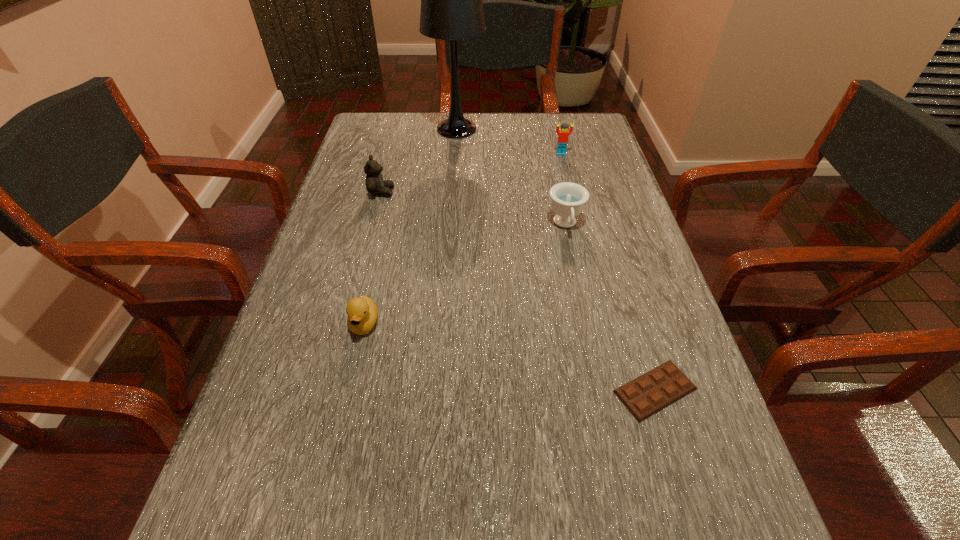
The image size is (960, 540). Identify the location of free spot located 0.350m on the face of the fifth nearest object. pyautogui.click(x=581, y=235).

Image resolution: width=960 pixels, height=540 pixels. I want to click on vacant region located on the side of the third nearest object with the handle, so click(580, 293).

The height and width of the screenshot is (540, 960). Find the location of `vacant area located facing forward on the duckling`. vacant area located facing forward on the duckling is located at coordinates (342, 424).

You are a GUI agent. You are given a task and a screenshot of the screen. Output one action in this format:
    pyautogui.click(x=<x>, y=<y>)
    Task: Click on the free location located on the back of the chocolate bar
    
    Given the screenshot: What is the action you would take?
    pyautogui.click(x=639, y=338)

Where is `table lamp located in the far edge section of the desktop`? The height and width of the screenshot is (540, 960). table lamp located in the far edge section of the desktop is located at coordinates (451, 0).

Where is `Lego that is at the far edge`? The image size is (960, 540). Lego that is at the far edge is located at coordinates (563, 134).

Identify the location of teddy bear situated at the left edge. (375, 184).

What are the coordinates of `duckling that is at the left edge` in the screenshot? It's located at (362, 311).

Find the location of a particular element. Lego located at the right edge is located at coordinates pyautogui.click(x=563, y=134).

Find the location of a particular element. This screenshot has width=960, height=540. teacup located in the right edge section of the desktop is located at coordinates (568, 199).